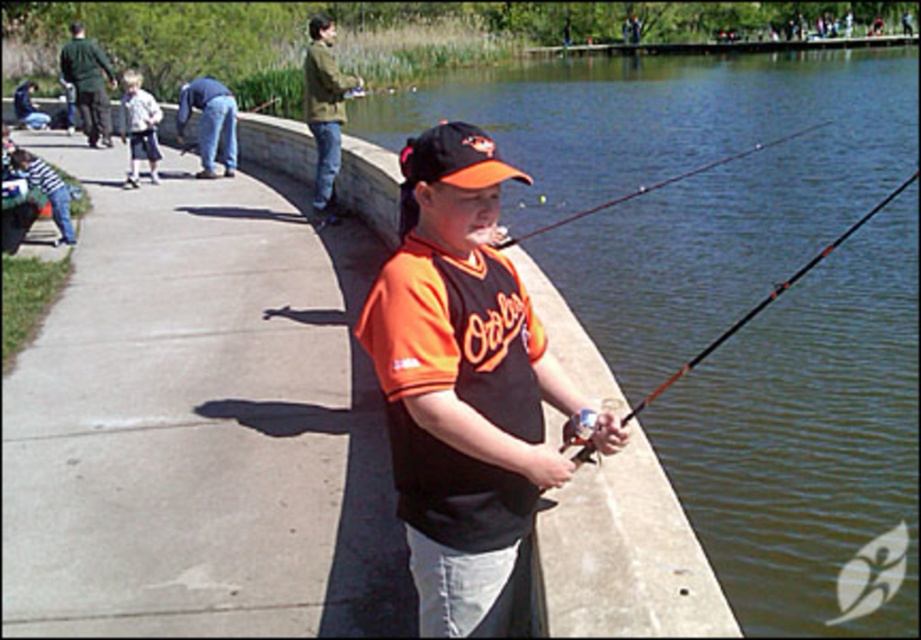
You are standing at the lakeside and want to take a photo of the orange jersey at center. If your camera has a maximum focus range of 6 feet, will you be able to capture a clear photo?

The orange jersey at center is 6.40 feet away from the camera. Since the maximum focus range is 6 feet, the camera cannot focus clearly beyond that distance. Therefore, the photo may appear blurry.

From the picture: You are a photographer trying to capture both the orange jersey at center and the light blue shorts at left in the same frame. Which object should you adjust your camera focus on first to ensure both are in the frame?

Since the orange jersey at center is thinner than the light blue shorts at left, you should focus on the light blue shorts at left first as it is wider and will occupy more space in the frame, ensuring the thinner orange jersey at center is also captured.